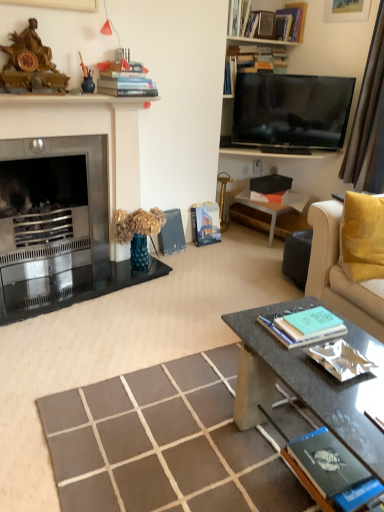
Find the location of a particular element. hardcover books at upper center, which appears as the 7th book when ordered from the bottom is located at coordinates (125, 81).

What do you see at coordinates (205, 223) in the screenshot?
I see `hardcover book at center, the fifth book viewed from the top` at bounding box center [205, 223].

What do you see at coordinates (279, 22) in the screenshot?
I see `hardcover book at upper center, which ranks as the 1th book in top-to-bottom order` at bounding box center [279, 22].

I want to click on hardcover book at center, which is the 6th book from top to bottom, so click(172, 233).

Find the location of a particular element. The height and width of the screenshot is (512, 384). hardcover books at upper center, which appears as the 7th book when ordered from the bottom is located at coordinates (125, 81).

From the image's perspective, between brown textured rug at center and blue hardcover book at lower right, arranged as the 9th book when viewed from the top, which one is located above?

blue hardcover book at lower right, arranged as the 9th book when viewed from the top, from the image's perspective.

Considering the sizes of objects brown textured rug at center and blue hardcover book at lower right, the 1th book ordered from the bottom, in the image provided, who is taller, brown textured rug at center or blue hardcover book at lower right, the 1th book ordered from the bottom,?

Standing taller between the two is brown textured rug at center.

Considering the positions of points (274, 438) and (318, 485), is point (274, 438) farther from camera compared to point (318, 485)?

Yes.

In the image, is brown textured rug at center positioned in front of or behind blue hardcover book at lower right, the 1th book ordered from the bottom?

Clearly, brown textured rug at center is in front of blue hardcover book at lower right, the 1th book ordered from the bottom.

Considering the positions of point (264, 197) and point (367, 449), is point (264, 197) closer or farther from the camera than point (367, 449)?

Point (264, 197) is farther from the camera than point (367, 449).

From a real-world perspective, relative to dark gray concrete coffee table at lower right, is orange matte book at right, which ranks as the 4th book in top-to-bottom order, vertically above or below?

orange matte book at right, which ranks as the 4th book in top-to-bottom order, is above dark gray concrete coffee table at lower right.

Could you tell me if orange matte book at right, marked as the sixth book in a bottom-to-top arrangement, is facing dark gray concrete coffee table at lower right?

Yes, orange matte book at right, marked as the sixth book in a bottom-to-top arrangement, is turned towards dark gray concrete coffee table at lower right.

In the image, is orange matte book at right, marked as the sixth book in a bottom-to-top arrangement, on the left side or the right side of dark gray concrete coffee table at lower right?

In the image, orange matte book at right, marked as the sixth book in a bottom-to-top arrangement, appears on the right side of dark gray concrete coffee table at lower right.

Can you tell me how much soft yellow fabric couch at right and teal matte book at center, which is the 7th book from top to bottom, differ in facing direction?

The facing directions of soft yellow fabric couch at right and teal matte book at center, which is the 7th book from top to bottom, are 94.8 degrees apart.

Is soft yellow fabric couch at right turned away from teal matte book at center, the 3th book when ordered from bottom to top?

soft yellow fabric couch at right is not turned away from teal matte book at center, the 3th book when ordered from bottom to top.

In terms of width, does soft yellow fabric couch at right look wider or thinner when compared to teal matte book at center, the 3th book when ordered from bottom to top?

Considering their sizes, soft yellow fabric couch at right looks slimmer than teal matte book at center, the 3th book when ordered from bottom to top.

Is soft yellow fabric couch at right further to the viewer compared to teal matte book at center, the 3th book when ordered from bottom to top?

Yes, soft yellow fabric couch at right is behind teal matte book at center, the 3th book when ordered from bottom to top.

Is shiny metallic book at center-right, the eighth book positioned from the top, behind matte black fireplace mantel at upper left?

No.

From the image's perspective, would you say shiny metallic book at center-right, the eighth book positioned from the top, is positioned over matte black fireplace mantel at upper left?

No, from the image's perspective, shiny metallic book at center-right, the eighth book positioned from the top, is not on top of matte black fireplace mantel at upper left.

Can you see shiny metallic book at center-right, which ranks as the 2th book in bottom-to-top order, touching matte black fireplace mantel at upper left?

No, shiny metallic book at center-right, which ranks as the 2th book in bottom-to-top order, is not touching matte black fireplace mantel at upper left.

Considering the positions of objects shiny metallic book at center-right, which ranks as the 2th book in bottom-to-top order, and matte black fireplace mantel at upper left in the image provided, who is more to the left, shiny metallic book at center-right, which ranks as the 2th book in bottom-to-top order, or matte black fireplace mantel at upper left?

From the viewer's perspective, matte black fireplace mantel at upper left appears more on the left side.

Which object is more forward, matte black fireplace mantel at upper left or soft yellow fabric couch at right?

soft yellow fabric couch at right is in front.

Could soft yellow fabric couch at right be considered to be inside matte black fireplace mantel at upper left?

No, soft yellow fabric couch at right is not a part of matte black fireplace mantel at upper left.

Based on their positions, is matte black fireplace mantel at upper left located to the left or right of soft yellow fabric couch at right?

Clearly, matte black fireplace mantel at upper left is on the left of soft yellow fabric couch at right in the image.

Do you think metallic fireplace at left is within hardcover book at center, the 4th book when ordered from bottom to top, or outside of it?

metallic fireplace at left cannot be found inside hardcover book at center, the 4th book when ordered from bottom to top.

Considering the sizes of objects metallic fireplace at left and hardcover book at center, the 4th book when ordered from bottom to top, in the image provided, who is thinner, metallic fireplace at left or hardcover book at center, the 4th book when ordered from bottom to top,?

Thinner between the two is hardcover book at center, the 4th book when ordered from bottom to top.

I want to click on fireplace in front of the hardcover book at center, the 4th book when ordered from bottom to top, so click(67, 212).

Is hardcover book at center, the 4th book when ordered from bottom to top, not inside shiny metallic book at center-right, which ranks as the 2th book in bottom-to-top order?

hardcover book at center, the 4th book when ordered from bottom to top, lies outside shiny metallic book at center-right, which ranks as the 2th book in bottom-to-top order,'s area.

Considering the points (181, 232) and (340, 379), which point is in front, point (181, 232) or point (340, 379)?

The point (340, 379) is closer.

Would you consider hardcover book at center, which is the 6th book from top to bottom, to be distant from shiny metallic book at center-right, which ranks as the 2th book in bottom-to-top order?

That's right, there is a large distance between hardcover book at center, which is the 6th book from top to bottom, and shiny metallic book at center-right, which ranks as the 2th book in bottom-to-top order.

Can you confirm if hardcover book at center, which is the 6th book from top to bottom, is shorter than shiny metallic book at center-right, which ranks as the 2th book in bottom-to-top order?

In fact, hardcover book at center, which is the 6th book from top to bottom, may be taller than shiny metallic book at center-right, which ranks as the 2th book in bottom-to-top order.

What are the coordinates of `square that is under the blue hardcover book at lower right, the 1th book ordered from the bottom (from a real-world perspective)` in the screenshot? It's located at click(x=166, y=444).

The width and height of the screenshot is (384, 512). Identify the location of book that is the 4th object to the right of the dark gray concrete coffee table at lower right, starting at the anchor. (267, 196).

Based on their spatial positions, is hardcover books at upper center, which is the 3th book from top to bottom, or blue hardcover book at lower right, arranged as the 9th book when viewed from the top, closer to teal matte book at center, the 3th book when ordered from bottom to top?

blue hardcover book at lower right, arranged as the 9th book when viewed from the top, lies closer to teal matte book at center, the 3th book when ordered from bottom to top, than the other object.

Which object lies further to the anchor point dark gray concrete coffee table at lower right, metallic fireplace at left or matte black fireplace mantel at upper left?

matte black fireplace mantel at upper left lies further to dark gray concrete coffee table at lower right than the other object.

Which object lies further to the anchor point soft yellow fabric couch at right, dark gray concrete coffee table at lower right or teal matte book at center, which is the 7th book from top to bottom?

Among the two, dark gray concrete coffee table at lower right is located further to soft yellow fabric couch at right.

Which object lies nearer to the anchor point soft yellow fabric couch at right, hardcover books at upper center, acting as the 2th book starting from the top, or blue hardcover book at lower right, the 1th book ordered from the bottom?

The object closer to soft yellow fabric couch at right is blue hardcover book at lower right, the 1th book ordered from the bottom.

From the image, which object appears to be nearer to matte black fireplace mantel at upper left, metallic fireplace at left or dark gray concrete coffee table at lower right?

metallic fireplace at left is positioned closer to the anchor matte black fireplace mantel at upper left.

From the image, which object appears to be farther from flat screen tv at upper right, shiny metallic book at center-right, which ranks as the 2th book in bottom-to-top order, or metallic silver side table at center right?

shiny metallic book at center-right, which ranks as the 2th book in bottom-to-top order, is further to flat screen tv at upper right.

Considering their positions, is metallic silver side table at center right positioned further to flat screen tv at upper right than dark gray concrete coffee table at lower right?

dark gray concrete coffee table at lower right.

From the image, which object appears to be farther from brown textured rug at center, brown fabric curtain at right or dark gray concrete coffee table at lower right?

Among the two, brown fabric curtain at right is located further to brown textured rug at center.

Where is `television between hardcover book at center, which is the 6th book from top to bottom, and brown fabric curtain at right`? The height and width of the screenshot is (512, 384). television between hardcover book at center, which is the 6th book from top to bottom, and brown fabric curtain at right is located at coordinates (291, 110).

The width and height of the screenshot is (384, 512). I want to click on mantle between flat screen tv at upper right and blue hardcover book at lower right, the 1th book ordered from the bottom, in the vertical direction, so click(x=73, y=99).

You are a GUI agent. You are given a task and a screenshot of the screen. Output one action in this format:
    pyautogui.click(x=<x>, y=<y>)
    Task: Click on the curtain positioned between soft yellow fabric couch at right and orange matte book at right, which ranks as the 4th book in top-to-bottom order, from near to far
    This screenshot has height=512, width=384.
    Given the screenshot: What is the action you would take?
    pyautogui.click(x=368, y=121)

In order to click on television between teal matte book at center, which is the 7th book from top to bottom, and hardcover book at center, which is the 6th book from top to bottom, in the front-back direction in this screenshot , I will do `click(291, 110)`.